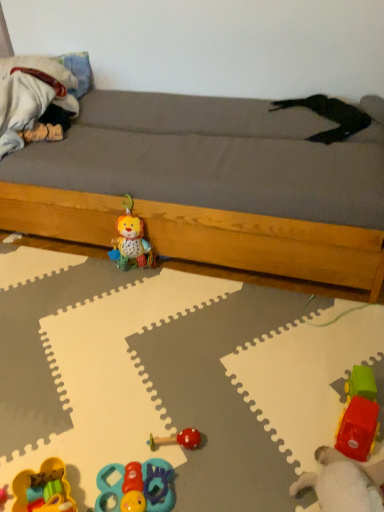
Identify the location of unoccupied region to the right of plush fabric lion at center, the 2th toy when ordered from left to right. This screenshot has width=384, height=512. (177, 279).